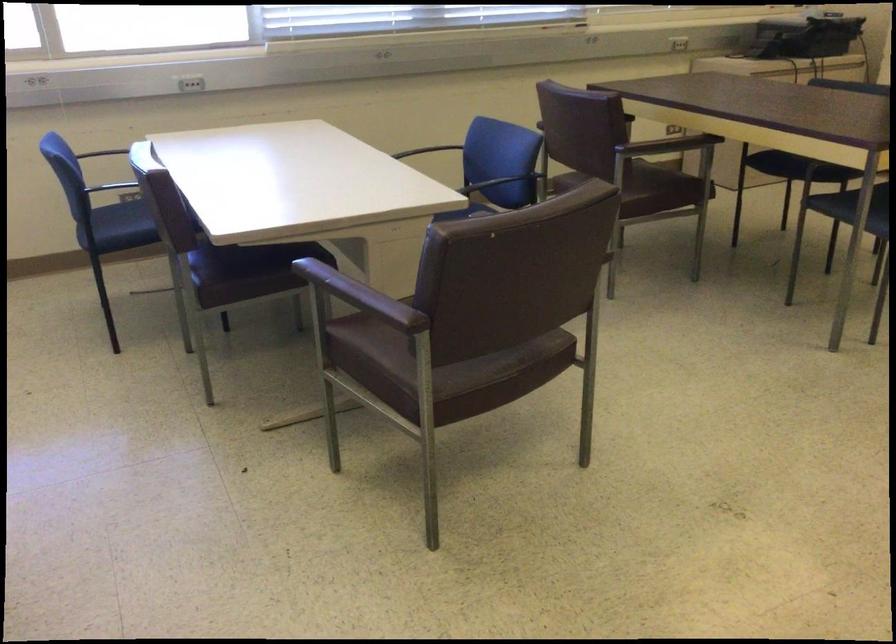
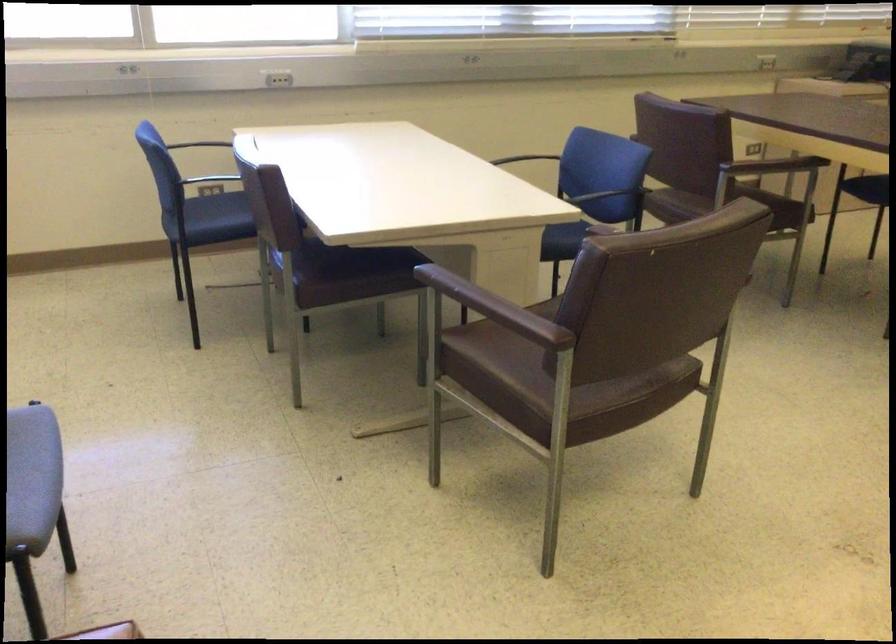
Where in the second image is the point corresponding to point (461, 384) from the first image?

(588, 404)